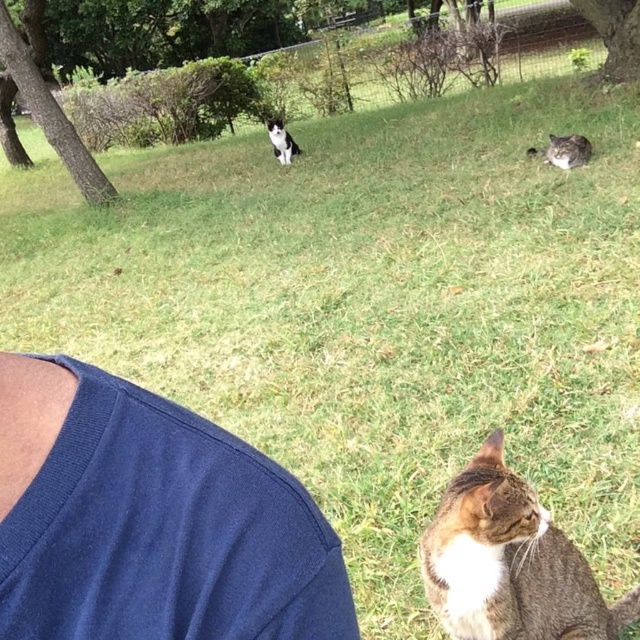
Question: Considering the relative positions of tabby fur cat at center and fuzzy gray cat at upper right in the image provided, where is tabby fur cat at center located with respect to fuzzy gray cat at upper right?

Choices:
 (A) above
 (B) below

Answer: (B)

Question: Which of the following is the farthest from the observer?

Choices:
 (A) fuzzy gray cat at upper right
 (B) tabby fur cat at center
 (C) black and white fur cat at upper center

Answer: (C)

Question: Is tabby fur cat at center behind black and white fur cat at upper center?

Choices:
 (A) no
 (B) yes

Answer: (A)

Question: Which point is farther to the camera?

Choices:
 (A) tabby fur cat at center
 (B) black and white fur cat at upper center
 (C) navy blue fabric at lower left

Answer: (B)

Question: Which of the following is the farthest from the observer?

Choices:
 (A) (566, 163)
 (B) (33, 538)
 (C) (288, 136)
 (D) (472, 508)

Answer: (C)

Question: Is navy blue fabric at lower left positioned before tabby fur cat at center?

Choices:
 (A) no
 (B) yes

Answer: (B)